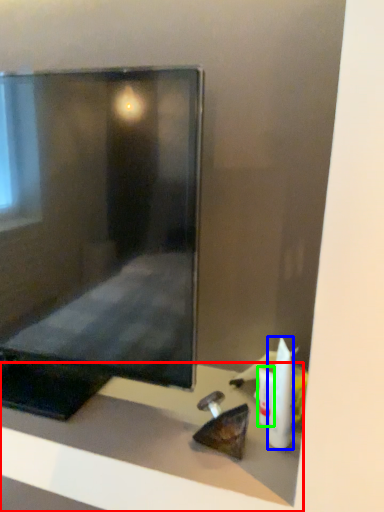
Question: Estimate the real-world distances between objects in this image. Which object is farther from furniture (highlighted by a red box), toiletry (highlighted by a blue box) or toiletry (highlighted by a green box)?

Choices:
 (A) toiletry
 (B) toiletry

Answer: (A)